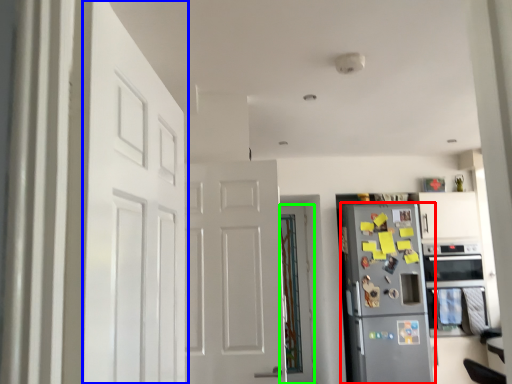
Question: Which object is positioned closest to refrigerator (highlighted by a red box)? Select from door (highlighted by a blue box) and door (highlighted by a green box).

Choices:
 (A) door
 (B) door

Answer: (B)